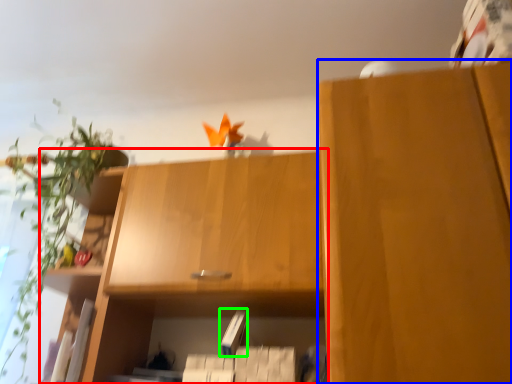
Question: Which object is positioned farthest from cabinetry (highlighted by a red box)? Select from cabinetry (highlighted by a blue box) and paperback book (highlighted by a green box).

Choices:
 (A) cabinetry
 (B) paperback book

Answer: (A)